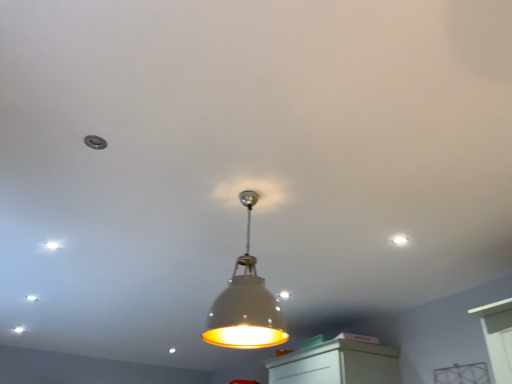
Locate an element on the screen. This screenshot has height=384, width=512. white matte lampshade at center is located at coordinates (246, 304).

At what (x,y) coordinates should I click in order to perform the action: click on white glossy dot at upper left, the second dot viewed from the front. Please return your answer as a coordinate pair (x, y). Looking at the image, I should click on (53, 245).

At what (x,y) coordinates should I click in order to perform the action: click on white matte light fixture at upper center, the first dot when ordered from front to back. Please return your answer as a coordinate pair (x, y). The image size is (512, 384). Looking at the image, I should click on (400, 240).

Does point (249, 265) appear closer or farther from the camera than point (52, 241)?

Point (249, 265) is closer to the camera than point (52, 241).

Is white matte lampshade at center taller or shorter than white glossy dot at upper left, which is the second dot in right-to-left order?

In the image, white matte lampshade at center appears to be taller than white glossy dot at upper left, which is the second dot in right-to-left order.

In the scene shown: Is white matte lampshade at center to the left or to the right of white glossy dot at upper left, which is the second dot in right-to-left order, in the image?

white matte lampshade at center is to the right of white glossy dot at upper left, which is the second dot in right-to-left order.

Is white matte lampshade at center positioned with its back to white glossy dot at upper left, the second dot positioned from the top?

No, white matte lampshade at center's orientation is not away from white glossy dot at upper left, the second dot positioned from the top.

Can you confirm if white matte light fixture at upper center, the first dot when ordered from front to back, is taller than white matte lampshade at center?

In fact, white matte light fixture at upper center, the first dot when ordered from front to back, may be shorter than white matte lampshade at center.

Can you confirm if white matte light fixture at upper center, arranged as the 2th dot when viewed from the back, is smaller than white matte lampshade at center?

Yes, white matte light fixture at upper center, arranged as the 2th dot when viewed from the back, is smaller than white matte lampshade at center.

Is white matte light fixture at upper center, the first dot when ordered from top to bottom, far from white matte lampshade at center?

Yes, white matte light fixture at upper center, the first dot when ordered from top to bottom, and white matte lampshade at center are located far from each other.

Visually, is white matte light fixture at upper center, arranged as the 2th dot when viewed from the back, positioned to the left or to the right of white matte lampshade at center?

In the image, white matte light fixture at upper center, arranged as the 2th dot when viewed from the back, appears on the right side of white matte lampshade at center.

Considering the positions of objects white glossy dot at upper left, the 1th dot in the back-to-front sequence, and white matte light fixture at upper center, positioned as the 2th dot in left-to-right order, in the image provided, who is behind, white glossy dot at upper left, the 1th dot in the back-to-front sequence, or white matte light fixture at upper center, positioned as the 2th dot in left-to-right order,?

Positioned behind is white glossy dot at upper left, the 1th dot in the back-to-front sequence.

Which object is thinner, white glossy dot at upper left, the second dot viewed from the front, or white matte light fixture at upper center, the first dot when ordered from front to back?

white glossy dot at upper left, the second dot viewed from the front, is thinner.

Considering the relative sizes of white glossy dot at upper left, the second dot viewed from the front, and white matte light fixture at upper center, the 1th dot when ordered from right to left, in the image provided, is white glossy dot at upper left, the second dot viewed from the front, smaller than white matte light fixture at upper center, the 1th dot when ordered from right to left,?

Actually, white glossy dot at upper left, the second dot viewed from the front, might be larger than white matte light fixture at upper center, the 1th dot when ordered from right to left.

What's the angular difference between white glossy dot at upper left, which is the second dot in right-to-left order, and white matte light fixture at upper center, the first dot when ordered from top to bottom,'s facing directions?

The angle between the facing direction of white glossy dot at upper left, which is the second dot in right-to-left order, and the facing direction of white matte light fixture at upper center, the first dot when ordered from top to bottom, is 177 degrees.

Is white matte light fixture at upper center, the 2th dot from the bottom, situated inside white glossy dot at upper left, the 1th dot from the bottom, or outside?

white matte light fixture at upper center, the 2th dot from the bottom, lies outside white glossy dot at upper left, the 1th dot from the bottom.

Image resolution: width=512 pixels, height=384 pixels. Identify the location of dot located on the right of white glossy dot at upper left, the second dot viewed from the front. (400, 240).

Looking at this image, from a real-world perspective, is white matte light fixture at upper center, the first dot when ordered from front to back, positioned under white glossy dot at upper left, the 1th dot from the bottom, based on gravity?

No, from a real-world perspective, white matte light fixture at upper center, the first dot when ordered from front to back, is not below white glossy dot at upper left, the 1th dot from the bottom.

Considering the relative sizes of white matte light fixture at upper center, arranged as the 2th dot when viewed from the back, and white glossy dot at upper left, which ranks as the 1th dot in left-to-right order, in the image provided, is white matte light fixture at upper center, arranged as the 2th dot when viewed from the back, shorter than white glossy dot at upper left, which ranks as the 1th dot in left-to-right order,?

Yes.

Based on the photo, how different are the orientations of white glossy dot at upper left, the 1th dot in the back-to-front sequence, and white matte lampshade at center in degrees?

92.2 degrees.

Which is more to the right, white glossy dot at upper left, the second dot viewed from the front, or white matte lampshade at center?

white matte lampshade at center.

Considering the positions of points (54, 247) and (247, 224), is point (54, 247) closer to camera compared to point (247, 224)?

No.

Looking at the image, does white glossy dot at upper left, which ranks as the 1th dot in left-to-right order, seem bigger or smaller compared to white matte lampshade at center?

Considering their sizes, white glossy dot at upper left, which ranks as the 1th dot in left-to-right order, takes up less space than white matte lampshade at center.

Is white matte lampshade at center inside or outside of white matte light fixture at upper center, the first dot when ordered from top to bottom?

white matte lampshade at center is spatially situated outside white matte light fixture at upper center, the first dot when ordered from top to bottom.

Is point (245, 285) positioned behind point (403, 238)?

No.

How different are the orientations of white matte lampshade at center and white matte light fixture at upper center, the 2th dot from the bottom, in degrees?

They differ by 91 degrees in their facing directions.

Is white matte lampshade at center shorter than white matte light fixture at upper center, arranged as the 2th dot when viewed from the back?

No, white matte lampshade at center is not shorter than white matte light fixture at upper center, arranged as the 2th dot when viewed from the back.

This screenshot has height=384, width=512. What are the coordinates of `dot below the white matte lampshade at center (from the image's perspective)` in the screenshot? It's located at (53, 245).

The width and height of the screenshot is (512, 384). What are the coordinates of `the 1st dot behind the white matte lampshade at center` in the screenshot? It's located at (400, 240).

Considering their positions, is white matte light fixture at upper center, the 2th dot from the bottom, positioned further to white matte lampshade at center than white glossy dot at upper left, the 1th dot from the bottom?

white glossy dot at upper left, the 1th dot from the bottom, is further to white matte lampshade at center.

Looking at the image, which one is located further to white glossy dot at upper left, the 1th dot in the back-to-front sequence, white matte lampshade at center or white matte light fixture at upper center, the first dot when ordered from front to back?

Among the two, white matte light fixture at upper center, the first dot when ordered from front to back, is located further to white glossy dot at upper left, the 1th dot in the back-to-front sequence.

Estimate the real-world distances between objects in this image. Which object is further from white glossy dot at upper left, the second dot positioned from the top, white matte light fixture at upper center, the first dot when ordered from front to back, or white matte lampshade at center?

Among the two, white matte light fixture at upper center, the first dot when ordered from front to back, is located further to white glossy dot at upper left, the second dot positioned from the top.

Based on their spatial positions, is white glossy dot at upper left, the 1th dot from the bottom, or white matte light fixture at upper center, the 2th dot from the bottom, further from white matte lampshade at center?

white glossy dot at upper left, the 1th dot from the bottom.

Considering their positions, is white matte lampshade at center positioned closer to white matte light fixture at upper center, the first dot when ordered from top to bottom, than white glossy dot at upper left, the 1th dot in the back-to-front sequence?

white matte lampshade at center.

Considering their positions, is white glossy dot at upper left, the 1th dot from the bottom, positioned further to white matte light fixture at upper center, arranged as the 2th dot when viewed from the back, than white matte lampshade at center?

white glossy dot at upper left, the 1th dot from the bottom.

Image resolution: width=512 pixels, height=384 pixels. Find the location of `lamp between white glossy dot at upper left, the 1th dot from the bottom, and white matte light fixture at upper center, the first dot when ordered from top to bottom, in the horizontal direction`. lamp between white glossy dot at upper left, the 1th dot from the bottom, and white matte light fixture at upper center, the first dot when ordered from top to bottom, in the horizontal direction is located at coordinates (246, 304).